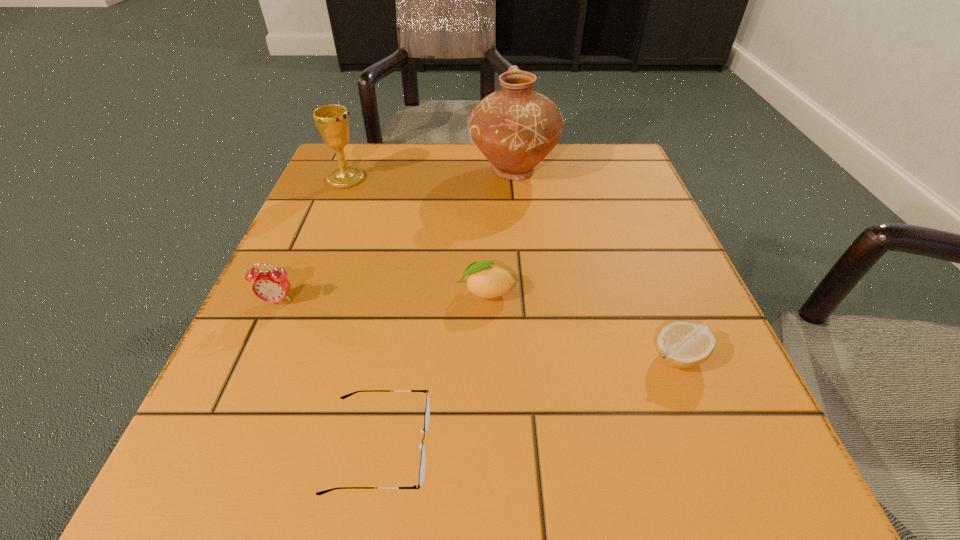
In order to click on pottery in this screenshot , I will do `click(515, 128)`.

This screenshot has height=540, width=960. I want to click on the fifth shortest object, so click(332, 121).

The height and width of the screenshot is (540, 960). What are the coordinates of `the fourth shortest object` in the screenshot? It's located at (273, 286).

You are a GUI agent. You are given a task and a screenshot of the screen. Output one action in this format:
    pyautogui.click(x=<x>, y=<y>)
    Task: Click on the left lemon
    The image size is (960, 540).
    Given the screenshot: What is the action you would take?
    pyautogui.click(x=485, y=280)

The height and width of the screenshot is (540, 960). Find the location of `the farther lemon`. the farther lemon is located at coordinates (485, 280).

Locate an element on the screen. the rightmost object is located at coordinates (682, 345).

Locate an element on the screen. This screenshot has width=960, height=540. the nearer lemon is located at coordinates (682, 345).

You are a GUI agent. You are given a task and a screenshot of the screen. Output one action in this format:
    pyautogui.click(x=<x>, y=<y>)
    Task: Click on the nearest object
    The height and width of the screenshot is (540, 960).
    Given the screenshot: What is the action you would take?
    pyautogui.click(x=427, y=409)

What are the coordinates of `the fourth object from right to left` in the screenshot? It's located at [427, 409].

Where is `vacant area located 0.050m on the front of the chalice`? vacant area located 0.050m on the front of the chalice is located at coordinates (336, 202).